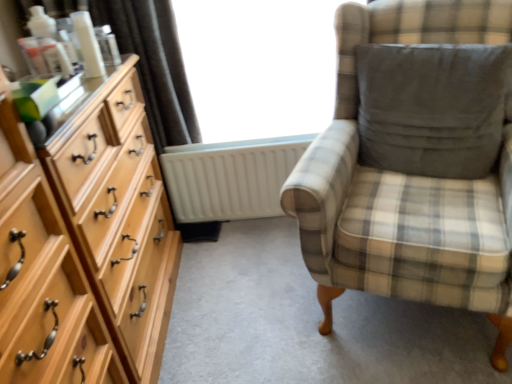
Question: Is transparent glass window at center in front of or behind satin dark brown curtain at upper left in the image?

Choices:
 (A) front
 (B) behind

Answer: (B)

Question: Considering the positions of transparent glass window at center and satin dark brown curtain at upper left in the image, is transparent glass window at center wider or thinner than satin dark brown curtain at upper left?

Choices:
 (A) wide
 (B) thin

Answer: (A)

Question: Which of these objects is positioned closest to the light wood dresser at left?

Choices:
 (A) transparent glass window at center
 (B) white matte radiator at center
 (C) dark gray fabric pillow at right
 (D) matte plastic bottle at upper left
 (E) satin dark brown curtain at upper left

Answer: (D)

Question: Which is farther from the white matte radiator at center?

Choices:
 (A) dark gray fabric pillow at right
 (B) light wood dresser at left
 (C) transparent glass window at center
 (D) plaid fabric chair at right
 (E) matte plastic bottle at upper left

Answer: (E)